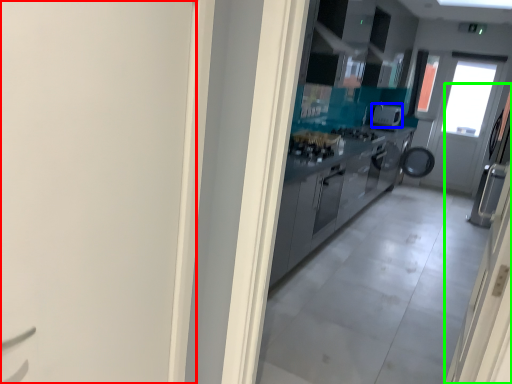
Question: Which object is positioned farthest from door (highlighted by a red box)? Select from appliance (highlighted by a blue box) and door (highlighted by a green box).

Choices:
 (A) appliance
 (B) door

Answer: (A)